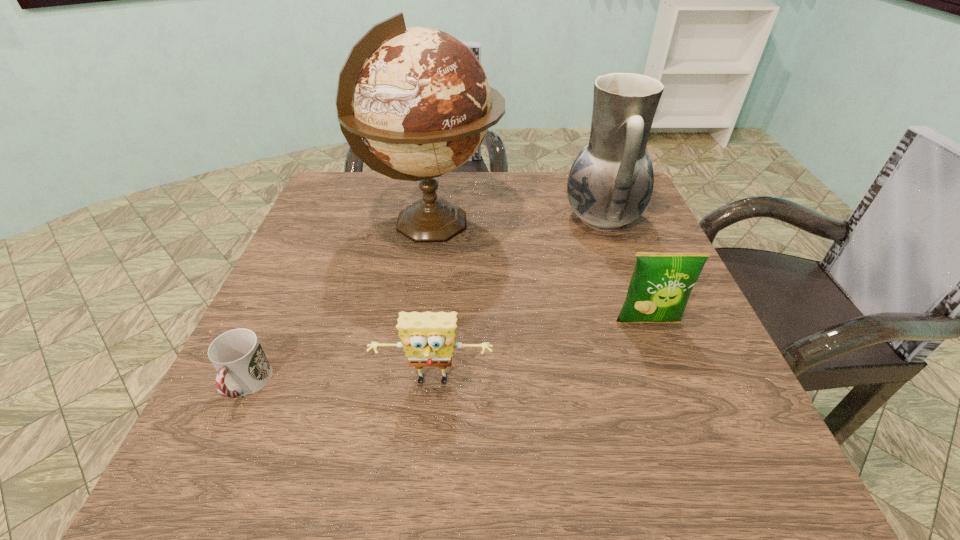
Find the location of a particular element. free space between the sponge and the pitcher is located at coordinates (517, 300).

The height and width of the screenshot is (540, 960). I want to click on vacant area that lies between the tallest object and the fourth shortest object, so click(517, 221).

This screenshot has width=960, height=540. What are the coordinates of `vacant space that is in between the globe and the sponge` in the screenshot? It's located at click(x=433, y=303).

The width and height of the screenshot is (960, 540). I want to click on unoccupied area between the pitcher and the third shortest object, so click(x=625, y=270).

Identify the location of vacant region between the sponge and the globe. (433, 303).

You are a GUI agent. You are given a task and a screenshot of the screen. Output one action in this format:
    pyautogui.click(x=<x>, y=<y>)
    Task: Click on the vacant point located between the sponge and the third tallest object
    This screenshot has height=540, width=960.
    Given the screenshot: What is the action you would take?
    pyautogui.click(x=540, y=353)

Locate which object is the closest to the third nearest object. Please provide its 2D coordinates. Your answer should be formatted as a tuple, i.e. [(x, y)], where the tuple contains the x and y coordinates of a point satisfying the conditions above.

[(610, 184)]

Where is `object that is the fourth closest one to the tallest object`? object that is the fourth closest one to the tallest object is located at coordinates (428, 338).

Find the location of a particular element. blank area in the image that satisfies the following two spatial constraints: 1. on the front of the tallest object showing Asia; 2. on the handle side of the shortest object is located at coordinates (410, 385).

The width and height of the screenshot is (960, 540). I want to click on vacant point that satisfies the following two spatial constraints: 1. on the front of the globe showing Asia; 2. on the handle side of the leftmost object, so click(410, 385).